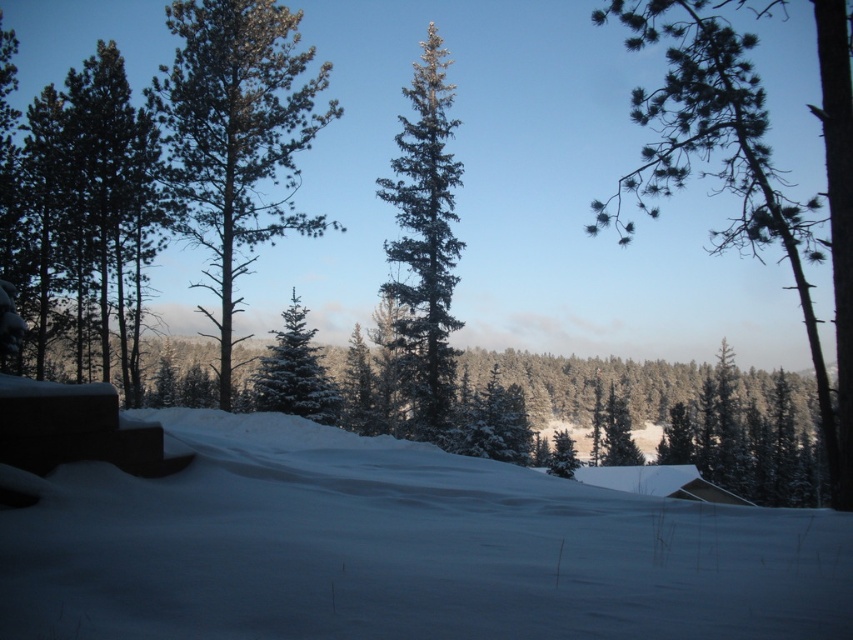
Question: Is green textured pine tree at center closer to camera compared to green matte evergreen tree at center?

Choices:
 (A) yes
 (B) no

Answer: (B)

Question: Among these points, which one is nearest to the camera?

Choices:
 (A) (450, 218)
 (B) (310, 332)
 (C) (122, 378)
 (D) (210, 177)

Answer: (D)

Question: Is green needle-like at upper right to the left of green textured pine tree at center from the viewer's perspective?

Choices:
 (A) yes
 (B) no

Answer: (B)

Question: Estimate the real-world distances between objects in this image. Which object is farther from the green matte tree at left?

Choices:
 (A) green needle-like at upper right
 (B) green matte evergreen tree at center
 (C) snow-covered evergreen tree at upper left
 (D) green textured pine tree at center

Answer: (A)

Question: Does green matte tree at left have a lesser width compared to snow-covered evergreen tree at upper left?

Choices:
 (A) no
 (B) yes

Answer: (B)

Question: Estimate the real-world distances between objects in this image. Which object is farther from the green needle-like at upper right?

Choices:
 (A) green matte tree at left
 (B) snow-covered evergreen tree at upper left
 (C) green matte evergreen tree at center

Answer: (C)